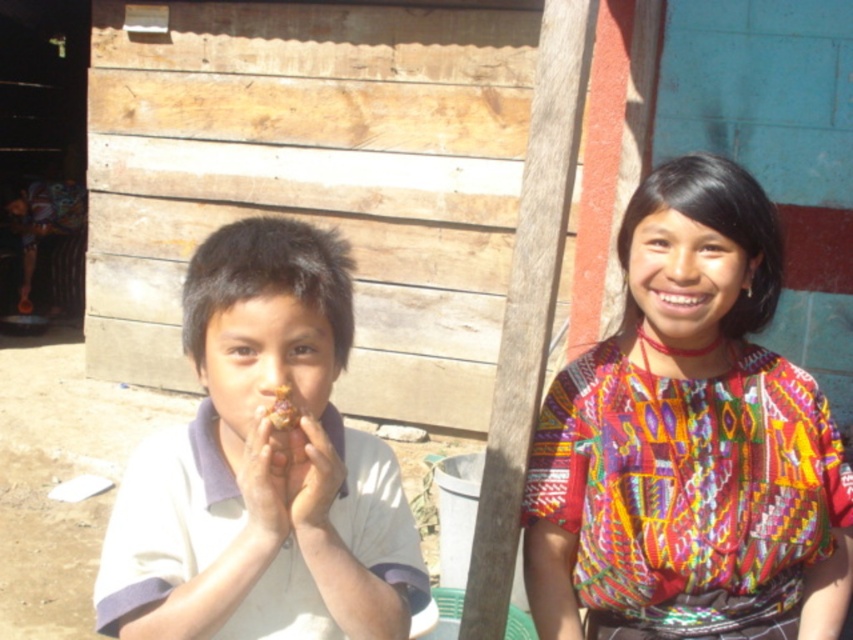
Question: Estimate the real-world distances between objects in this image. Which object is closer to the yellow matte food at center?

Choices:
 (A) multicolored woven blouse at right
 (B) white cotton shirt at left

Answer: (B)

Question: Can you confirm if white cotton shirt at left is positioned to the left of yellow matte food at center?

Choices:
 (A) yes
 (B) no

Answer: (A)

Question: Does white cotton shirt at left have a larger size compared to yellow matte food at center?

Choices:
 (A) yes
 (B) no

Answer: (A)

Question: Estimate the real-world distances between objects in this image. Which object is closer to the white cotton shirt at left?

Choices:
 (A) multicolored woven blouse at right
 (B) yellow matte food at center

Answer: (B)

Question: Based on their relative distances, which object is farther from the white cotton shirt at left?

Choices:
 (A) multicolored woven blouse at right
 (B) yellow matte food at center

Answer: (A)

Question: Can you confirm if multicolored woven blouse at right is thinner than yellow matte food at center?

Choices:
 (A) no
 (B) yes

Answer: (A)